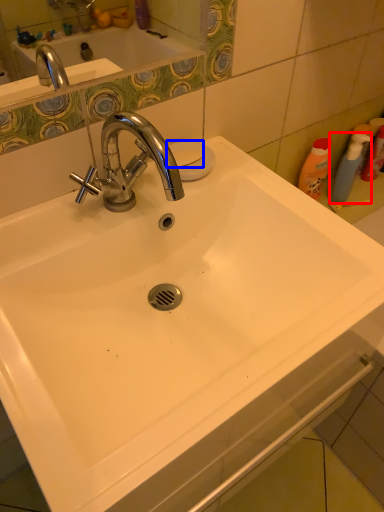
Question: Among these objects, which one is farthest to the camera, cleaning product (highlighted by a red box) or soap (highlighted by a blue box)?

Choices:
 (A) cleaning product
 (B) soap

Answer: (A)